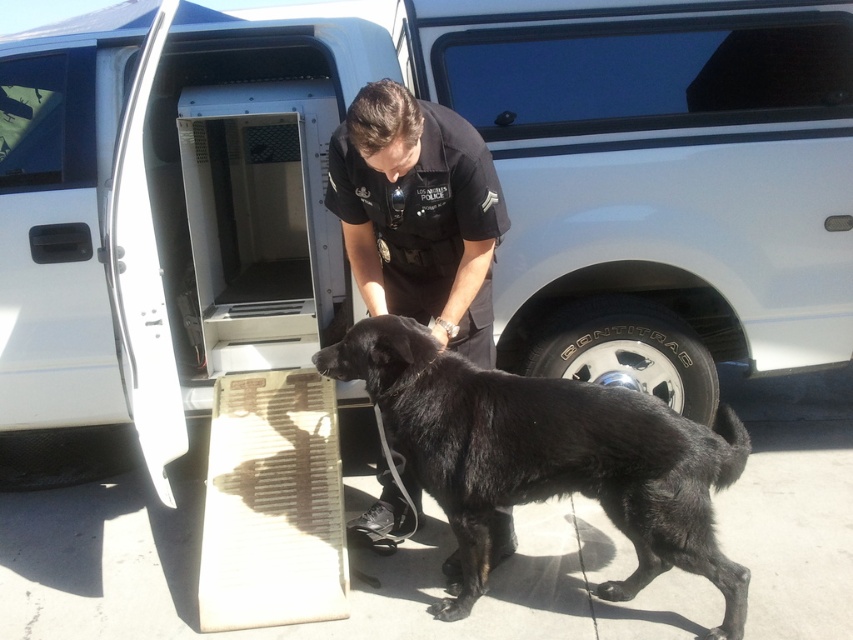
You are a photographer positioned to the side of the scene. You need to capture a photo where both the black fur dog at center and the black uniformed officer at center are clearly visible. Considering their sizes, which one might you need to adjust your camera angle for to ensure both are in focus?

Since the black fur dog at center is bigger than the black uniformed officer at center, you might need to adjust your camera angle slightly downward to ensure both are in focus while capturing the black fur dog at center and the black uniformed officer at center.

You are a police officer trying to locate your K9 partner in a photo. The scene shows a white police van with an open rear door and a ramp. Where is the black fur dog at center in terms of its 2D coordinates?

The black fur dog at center is located at the 2D coordinates point (548,458).